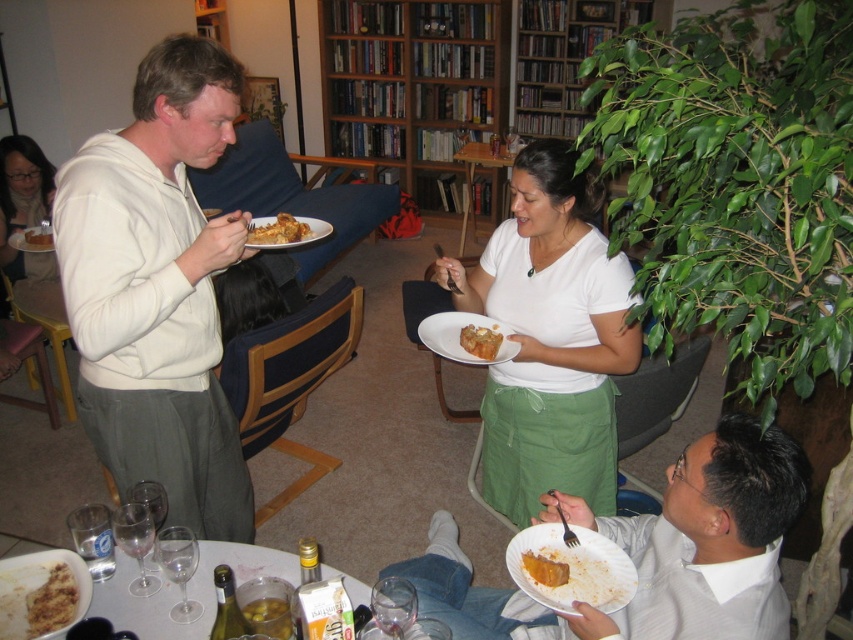
Measure the distance between point (364, 52) and camera.

Point (364, 52) is 5.68 meters away from camera.

Which of these two, wooden bookshelf at upper center or golden brown flaky pastry at upper center, stands taller?

wooden bookshelf at upper center

At what (x,y) coordinates should I click in order to perform the action: click on wooden bookshelf at upper center. Please return your answer as a coordinate pair (x, y). Looking at the image, I should click on (418, 92).

The height and width of the screenshot is (640, 853). Find the location of `wooden bookshelf at upper center`. wooden bookshelf at upper center is located at coordinates (418, 92).

Looking at this image, between white matte hoodie at upper left and golden brown flaky pastry at upper center, which one is positioned higher?

Positioned higher is golden brown flaky pastry at upper center.

Which is below, white matte hoodie at upper left or golden brown flaky pastry at upper center?

Positioned lower is white matte hoodie at upper left.

What do you see at coordinates (157, 289) in the screenshot? This screenshot has height=640, width=853. I see `white matte hoodie at upper left` at bounding box center [157, 289].

I want to click on white matte hoodie at upper left, so click(157, 289).

Is point (25, 234) positioned after point (36, 228)?

No, it is in front of (36, 228).

Who is shorter, matte white plate at upper left or golden brown cake at upper center?

Standing shorter between the two is golden brown cake at upper center.

Which is behind, point (30, 236) or point (39, 227)?

Positioned behind is point (39, 227).

Where is `matte white plate at upper left`? matte white plate at upper left is located at coordinates (32, 240).